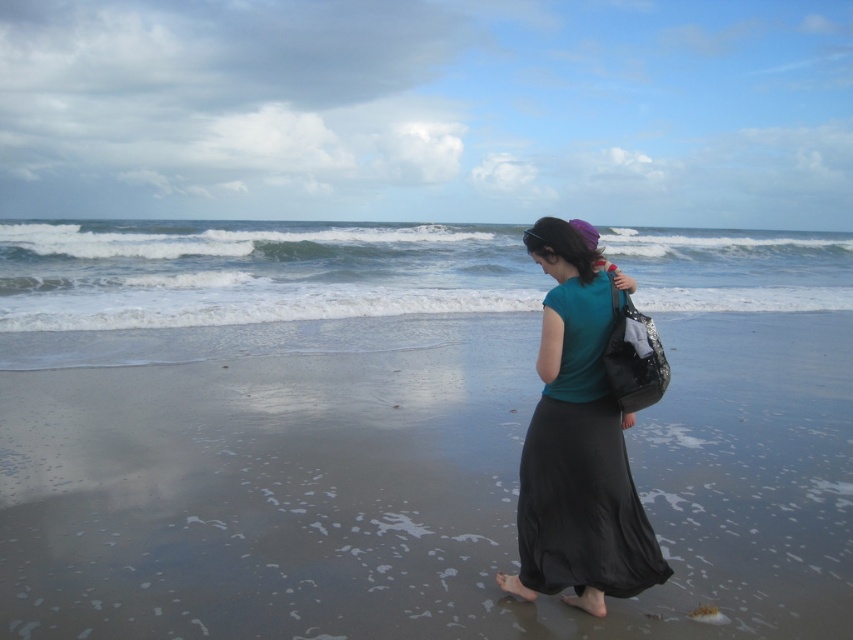
Is smooth sand at lower center positioned at the back of white foamy water at center?

No, smooth sand at lower center is in front of white foamy water at center.

Does smooth sand at lower center appear on the left side of white foamy water at center?

Incorrect, smooth sand at lower center is not on the left side of white foamy water at center.

This screenshot has height=640, width=853. I want to click on smooth sand at lower center, so tap(416, 490).

Which is more to the left, smooth sand at lower center or teal fabric shirt at center?

Positioned to the left is smooth sand at lower center.

Does smooth sand at lower center come in front of teal fabric shirt at center?

No, smooth sand at lower center is further to the viewer.

Does point (132, 472) lie behind point (599, 324)?

Yes, it is behind point (599, 324).

I want to click on smooth sand at lower center, so click(416, 490).

Which of these two, white foamy water at center or teal fabric shirt at center, stands taller?

white foamy water at center

Does white foamy water at center have a lesser height compared to teal fabric shirt at center?

In fact, white foamy water at center may be taller than teal fabric shirt at center.

Find the location of a particular element. white foamy water at center is located at coordinates (253, 273).

Locate an element on the screen. The width and height of the screenshot is (853, 640). white foamy water at center is located at coordinates (253, 273).